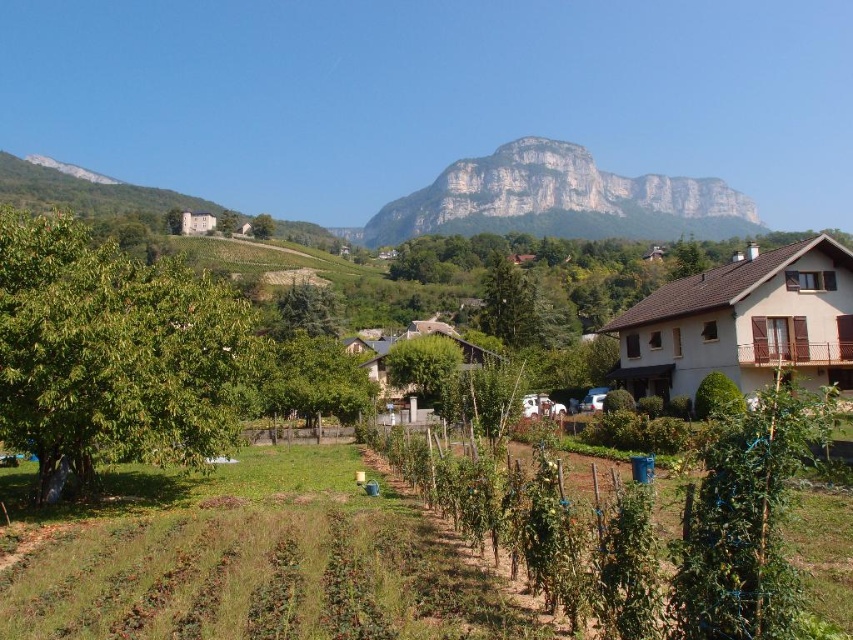
Who is higher up, green leafy tree at left or rugged stone mountain at upper center?

rugged stone mountain at upper center

Who is more distant from viewer, (216, 317) or (511, 163)?

Point (511, 163)

The width and height of the screenshot is (853, 640). I want to click on green leafy tree at left, so point(114,353).

Does green leafy tree at left have a larger size compared to green leafy tree at upper center?

Indeed, green leafy tree at left has a larger size compared to green leafy tree at upper center.

Is green leafy tree at left to the right of green leafy tree at upper center from the viewer's perspective?

Yes, green leafy tree at left is to the right of green leafy tree at upper center.

At what (x,y) coordinates should I click in order to perform the action: click on green leafy tree at left. Please return your answer as a coordinate pair (x, y). Looking at the image, I should click on (114, 353).

Does green leafy tree at center appear on the left side of green leafy tree at upper center?

In fact, green leafy tree at center is to the right of green leafy tree at upper center.

Who is positioned more to the right, green leafy tree at center or green leafy tree at upper center?

From the viewer's perspective, green leafy tree at center appears more on the right side.

Which is in front, point (428, 380) or point (271, 228)?

Point (428, 380)

Where is `green leafy tree at center`? green leafy tree at center is located at coordinates (422, 364).